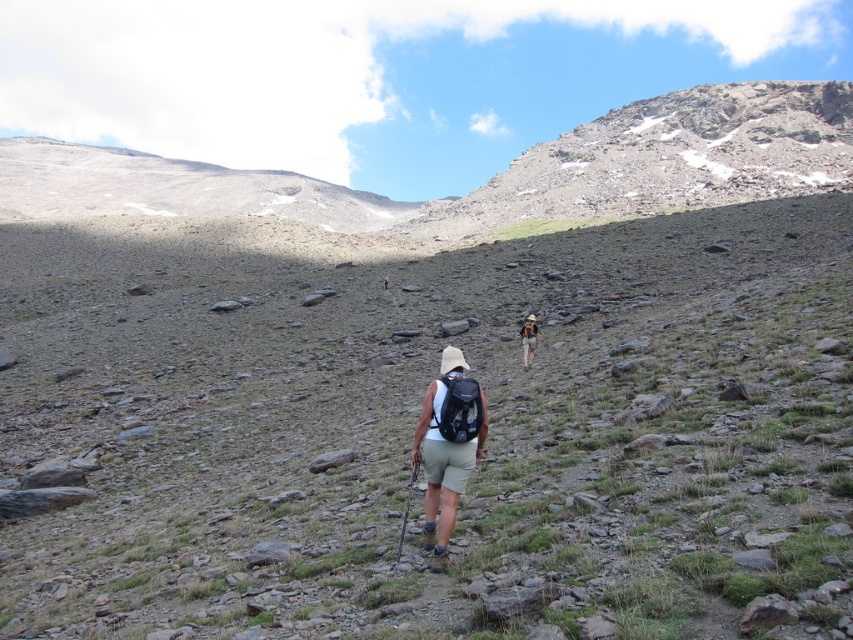
Question: Can you confirm if camouflage fabric backpack at center is positioned above matte black backpack at center?

Choices:
 (A) no
 (B) yes

Answer: (A)

Question: Can you confirm if white fabric shorts at center is positioned to the right of matte black backpack at center?

Choices:
 (A) no
 (B) yes

Answer: (B)

Question: Which object is the farthest from the camouflage fabric backpack at center?

Choices:
 (A) white fabric shorts at center
 (B) matte black backpack at center

Answer: (B)

Question: Observing the image, what is the correct spatial positioning of camouflage fabric backpack at center in reference to matte black backpack at center?

Choices:
 (A) below
 (B) above

Answer: (A)

Question: Which object is closer to the camera taking this photo?

Choices:
 (A) matte black backpack at center
 (B) white fabric shorts at center

Answer: (B)

Question: Which of the following is the closest to the observer?

Choices:
 (A) white fabric shorts at center
 (B) camouflage fabric backpack at center
 (C) matte black backpack at center

Answer: (A)